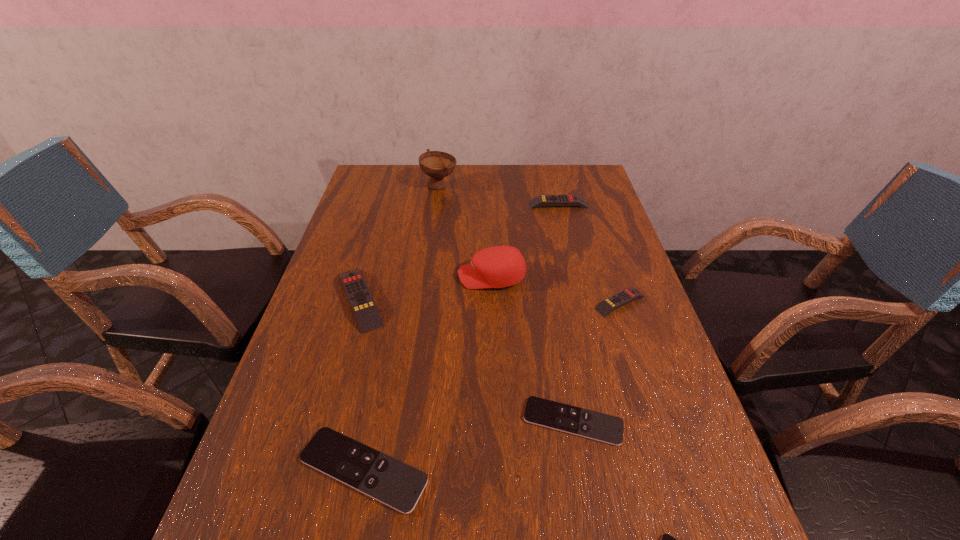
Locate which yellow remote control ranks in proximity to the fourth shortest object. Please provide its 2D coordinates. Your answer should be formatted as a tuple, i.e. [(x, y)], where the tuple contains the x and y coordinates of a point satisfying the conditions above.

[(542, 200)]

Identify which black remote control is located as the third nearest to the second tallest object. Please provide its 2D coordinates. Your answer should be formatted as a tuple, i.e. [(x, y)], where the tuple contains the x and y coordinates of a point satisfying the conditions above.

[(666, 539)]

The width and height of the screenshot is (960, 540). In order to click on black remote control identified as the second closest to the second biggest black remote control in this screenshot , I will do `click(398, 485)`.